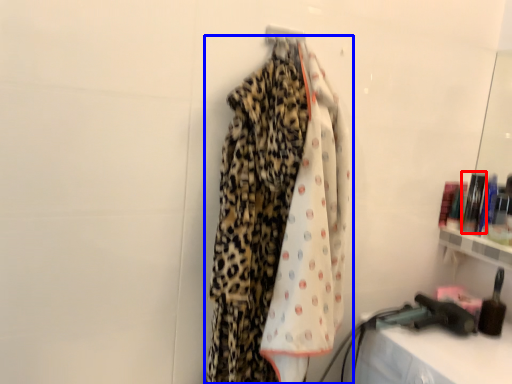
Question: Which object appears closest to the camera in this image, toiletry (highlighted by a red box) or curtain (highlighted by a blue box)?

Choices:
 (A) toiletry
 (B) curtain

Answer: (B)